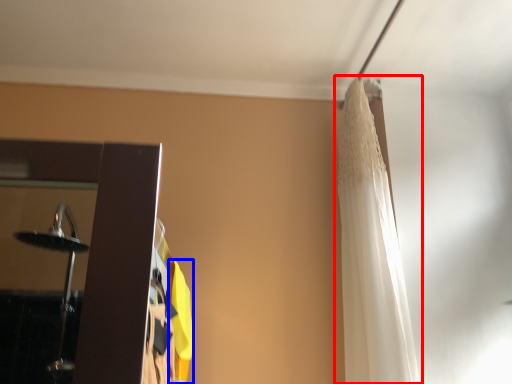
Question: Among these objects, which one is farthest to the camera, curtain (highlighted by a red box) or curtain (highlighted by a blue box)?

Choices:
 (A) curtain
 (B) curtain

Answer: (A)